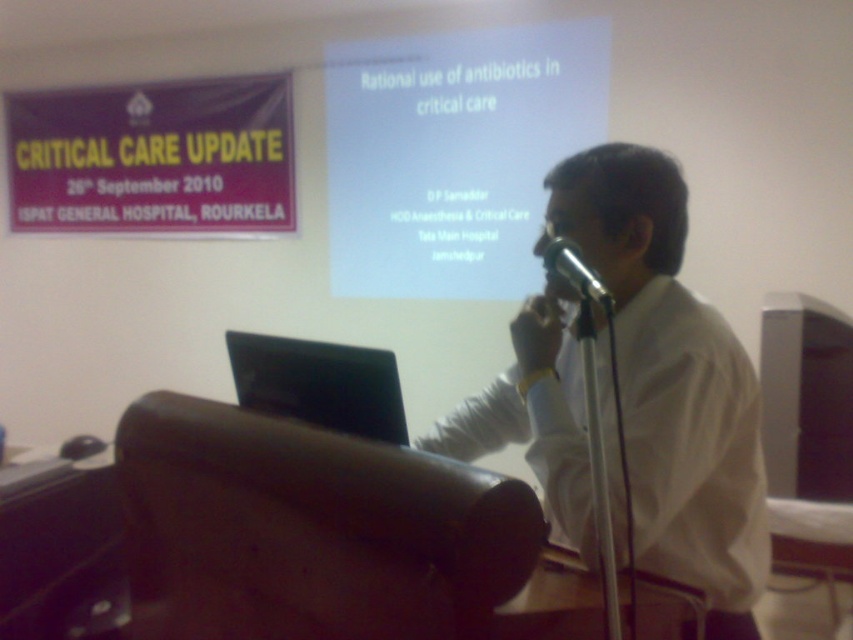
You are an attendee at the seminar and want to take a photo of the presentation slides displayed on the white matte projector screen at upper center. Your phone camera has a zoom feature. However, the metallic silver microphone at center is blocking your view. Can you zoom in enough to still capture the slides clearly without moving the microphone?

The white matte projector screen at upper center is larger than the metallic silver microphone at center, so zooming in might allow you to focus on the screen while avoiding the microphone blockage.

Based on the scene description, can you determine which object is wider between the purple fabric banner at upper left and the metallic silver microphone at center?

The purple fabric banner at upper left is wider than the metallic silver microphone at center according to the description.

You are attending the seminar and want to take a photo of the purple fabric banner at upper left and the metallic silver microphone at center. If you stand at the back of the room, which object will appear closer to you in your camera view?

The purple fabric banner at upper left will appear closer in your camera view because it is further to the viewer than the metallic silver microphone at center, meaning it is physically nearer to your position at the back of the room.